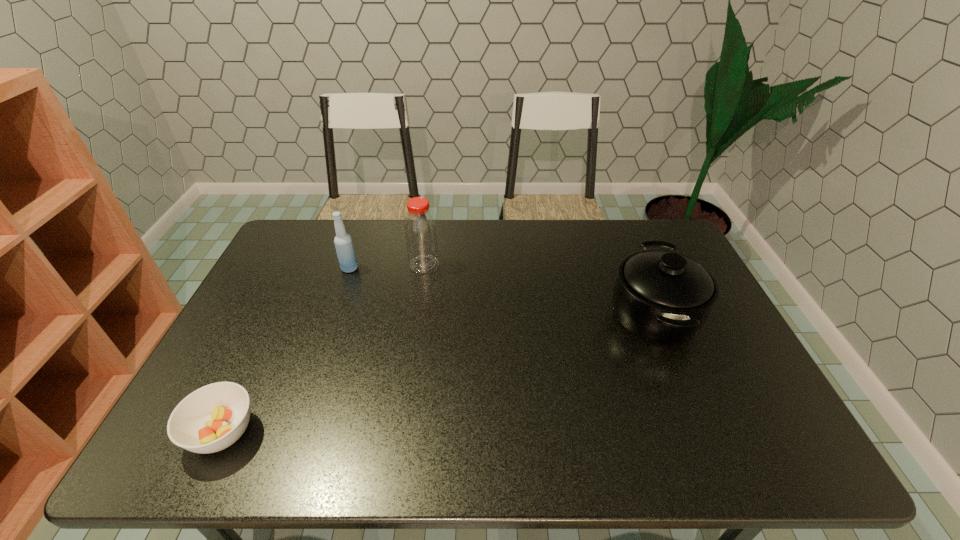
Identify the location of vacant point located between the left bottle and the shortest object. The image size is (960, 540). (286, 350).

At what (x,y) coordinates should I click in order to perform the action: click on vacant space in between the left bottle and the shortest object. Please return your answer as a coordinate pair (x, y). The width and height of the screenshot is (960, 540). Looking at the image, I should click on (286, 350).

Locate an element on the screen. The width and height of the screenshot is (960, 540). vacant space in between the leftmost object and the right bottle is located at coordinates (324, 348).

Where is `free space between the soup bowl and the saucepan`? free space between the soup bowl and the saucepan is located at coordinates pyautogui.click(x=439, y=373).

In order to click on vacant region between the leftmost object and the rightmost object in this screenshot , I will do `click(439, 373)`.

I want to click on empty space that is in between the nearest object and the third object from right to left, so click(286, 350).

At what (x,y) coordinates should I click in order to perform the action: click on vacant area that lies between the right bottle and the second object from left to right. Please return your answer as a coordinate pair (x, y). Looking at the image, I should click on (387, 266).

The width and height of the screenshot is (960, 540). Identify the location of free space between the soup bowl and the second object from right to left. (324, 348).

Where is `vacant space that's between the second object from right to left and the second object from left to right`? This screenshot has height=540, width=960. vacant space that's between the second object from right to left and the second object from left to right is located at coordinates (387, 266).

Locate which object is the second closest to the third object from right to left. Please provide its 2D coordinates. Your answer should be formatted as a tuple, i.e. [(x, y)], where the tuple contains the x and y coordinates of a point satisfying the conditions above.

[(213, 417)]